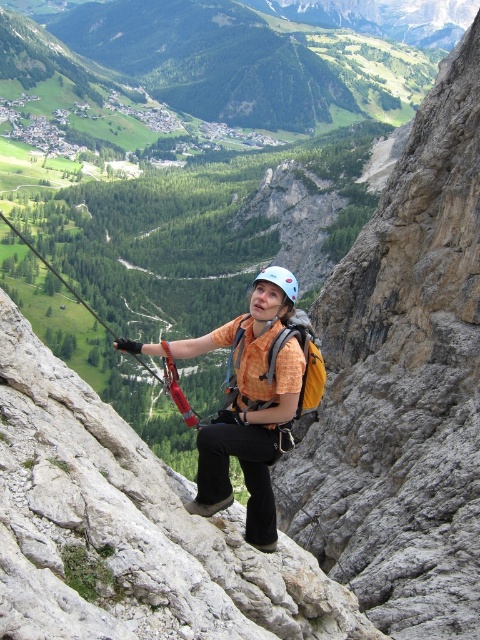
From the picture: You are a safety inspector checking the climbing gear setup. You notice the orange fabric shirt at center and the light blue matte helmet at center. According to safety protocols, the helmet should always be positioned above the shirt. Is the current arrangement compliant with safety standards?

The orange fabric shirt at center is below the light blue matte helmet at center, which aligns with safety protocols since the helmet is correctly positioned above the shirt.

You are a photographer taking a picture of the climber. You notice the orange fabric shirt at center and the light blue matte helmet at center. Which object should you focus on to ensure the subject is clearly visible in the photo?

The orange fabric shirt at center is larger in size than the light blue matte helmet at center, so focusing on the orange fabric shirt at center will ensure the subject is clearly visible in the photo.

You are a drone operator trying to capture a photo of the climber. The camera has a crosshair targeting system with coordinates from 0 to 1 on both axes. You need to focus on the orange fabric shirt at center. What are the coordinates you should aim for?

The orange fabric shirt at center is located at coordinates 0.623 on the x axis and 0.527 on the y axis.